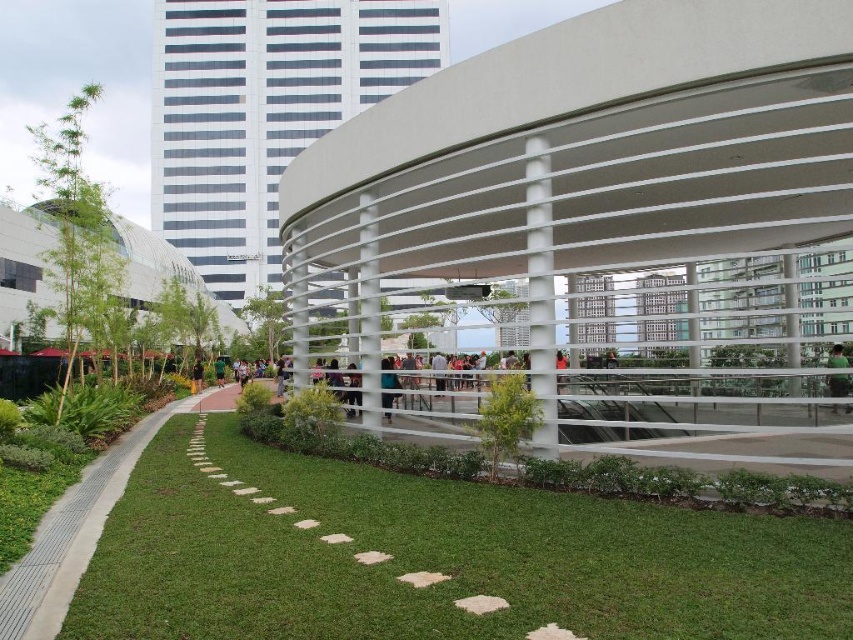
You are a gardener who wants to plant a new flower bed between the green grass at lower center and the green fabric at center. Based on their positions, which object should you start working on first to ensure the flower bed is correctly positioned?

Since the green grass at lower center is to the left of the green fabric at center, you should start working on the green grass at lower center first to position the flower bed correctly between them.

You are standing at the entrance of the park and see a black fabric person at lower left and a matte black person at center. Which one is closer to the entrance?

The black fabric person at lower left is closer to the entrance because it is positioned below the matte black person at center, indicating it is nearer to the observer.

From the picture: You are standing at the point marked by the coordinates point (436, 557) in the park. What is the immediate surface beneath your feet?

The immediate surface beneath your feet at point (436, 557) is green grass at lower center.